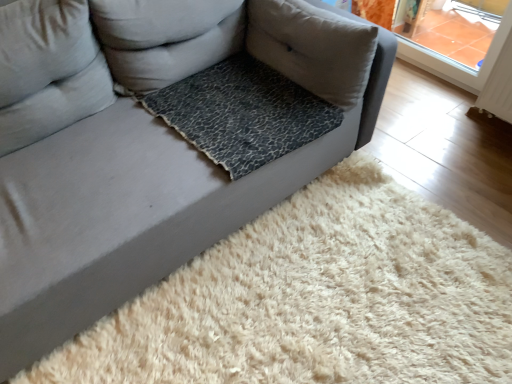
Question: Is leopard print fabric pillow at center, which is the second pillow in right-to-left order, closer to the viewer compared to leopard print fabric at center?

Choices:
 (A) no
 (B) yes

Answer: (B)

Question: Is leopard print fabric pillow at center, which is the second pillow in right-to-left order, not inside leopard print fabric at center?

Choices:
 (A) yes
 (B) no

Answer: (A)

Question: Is there a large distance between leopard print fabric pillow at center, the second pillow when ordered from left to right, and leopard print fabric at center?

Choices:
 (A) no
 (B) yes

Answer: (A)

Question: Is leopard print fabric pillow at center, which is the second pillow in right-to-left order, placed right next to leopard print fabric at center?

Choices:
 (A) no
 (B) yes

Answer: (A)

Question: Could you tell me if leopard print fabric pillow at center, the second pillow when ordered from left to right, is turned towards leopard print fabric at center?

Choices:
 (A) yes
 (B) no

Answer: (A)

Question: From the image's perspective, is leopard print fabric pillow at center, which is the second pillow in right-to-left order, located beneath leopard print fabric at center?

Choices:
 (A) no
 (B) yes

Answer: (A)

Question: Considering the relative sizes of leopard print fabric at center and leopard print fabric pillow at center, which is the second pillow in right-to-left order, in the image provided, is leopard print fabric at center taller than leopard print fabric pillow at center, which is the second pillow in right-to-left order,?

Choices:
 (A) no
 (B) yes

Answer: (A)

Question: Is leopard print fabric at center to the right of leopard print fabric pillow at center, which is the second pillow in right-to-left order, from the viewer's perspective?

Choices:
 (A) no
 (B) yes

Answer: (B)

Question: From the image's perspective, is leopard print fabric at center on top of leopard print fabric pillow at center, the second pillow when ordered from left to right?

Choices:
 (A) no
 (B) yes

Answer: (A)

Question: Is leopard print fabric pillow at center, which is the second pillow in right-to-left order, completely or partially inside leopard print fabric at center?

Choices:
 (A) no
 (B) yes

Answer: (A)

Question: Is leopard print fabric at center thinner than leopard print fabric pillow at center, which is the second pillow in right-to-left order?

Choices:
 (A) no
 (B) yes

Answer: (A)

Question: Is leopard print fabric at center oriented towards leopard print fabric pillow at center, which is the second pillow in right-to-left order?

Choices:
 (A) yes
 (B) no

Answer: (B)

Question: Considering the relative positions of leopard print fabric pillow at center, placed as the third pillow when sorted from left to right, and leopard print fabric at center in the image provided, is leopard print fabric pillow at center, placed as the third pillow when sorted from left to right, to the right of leopard print fabric at center from the viewer's perspective?

Choices:
 (A) yes
 (B) no

Answer: (A)